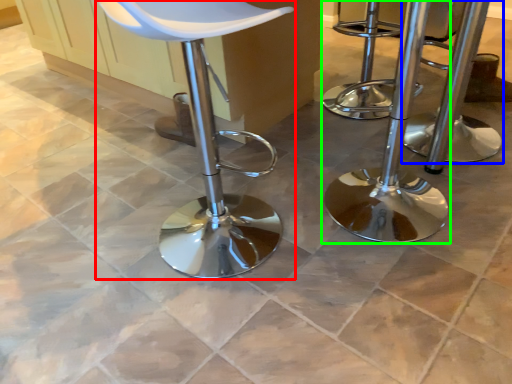
Question: Which object is the farthest from chair (highlighted by a red box)? Choose among these: stool (highlighted by a blue box) or stool (highlighted by a green box).

Choices:
 (A) stool
 (B) stool

Answer: (A)